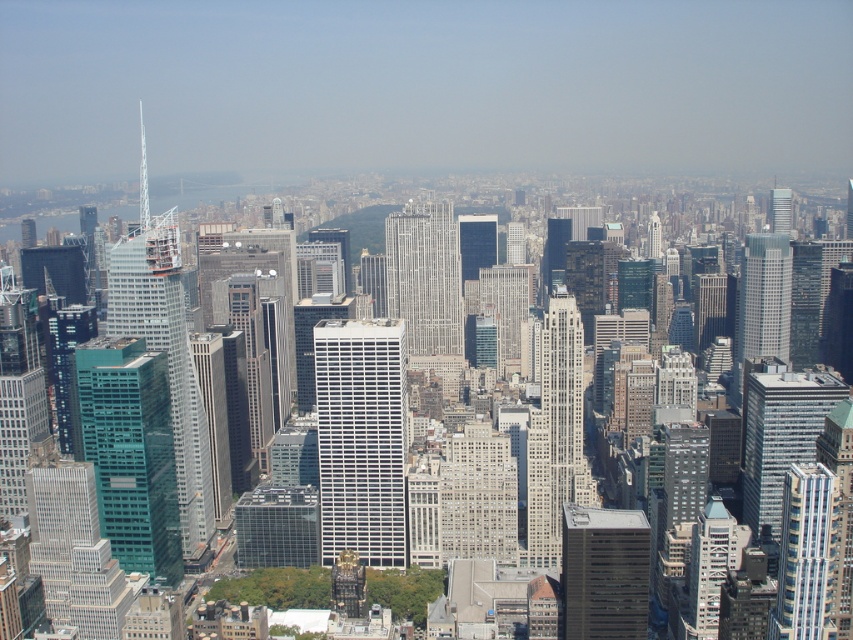
Question: Is green glass building at left to the right of teal glass skyscraper at left from the viewer's perspective?

Choices:
 (A) yes
 (B) no

Answer: (B)

Question: Which object appears closest to the camera in this image?

Choices:
 (A) silver metallic skyscraper at center
 (B) glassy reflective skyscraper at center
 (C) white glass skyscraper at center
 (D) white glass building at right

Answer: (A)

Question: Among these objects, which one is farthest from the camera?

Choices:
 (A) blue glass skyscraper at center-right
 (B) glassy reflective skyscraper at center
 (C) green glass building at left

Answer: (A)

Question: Which point is farther from the camera taking this photo?

Choices:
 (A) (805, 525)
 (B) (558, 348)

Answer: (A)

Question: Can you confirm if white glass building at center is positioned to the right of silver metallic skyscraper at center?

Choices:
 (A) no
 (B) yes

Answer: (A)

Question: Can you confirm if gray concrete skyscraper at lower right is positioned below glassy reflective skyscraper at center?

Choices:
 (A) no
 (B) yes

Answer: (B)